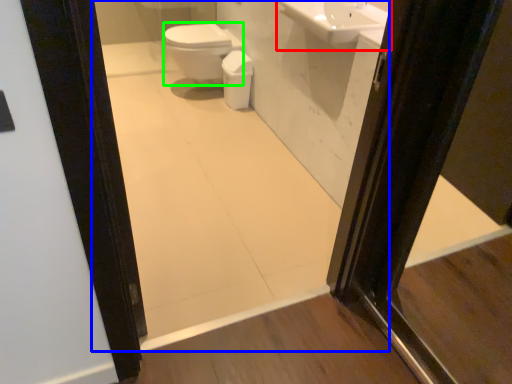
Question: Based on their relative distances, which object is farther from sink (highlighted by a red box)? Choose from mirror (highlighted by a blue box) and bidet (highlighted by a green box).

Choices:
 (A) mirror
 (B) bidet

Answer: (B)